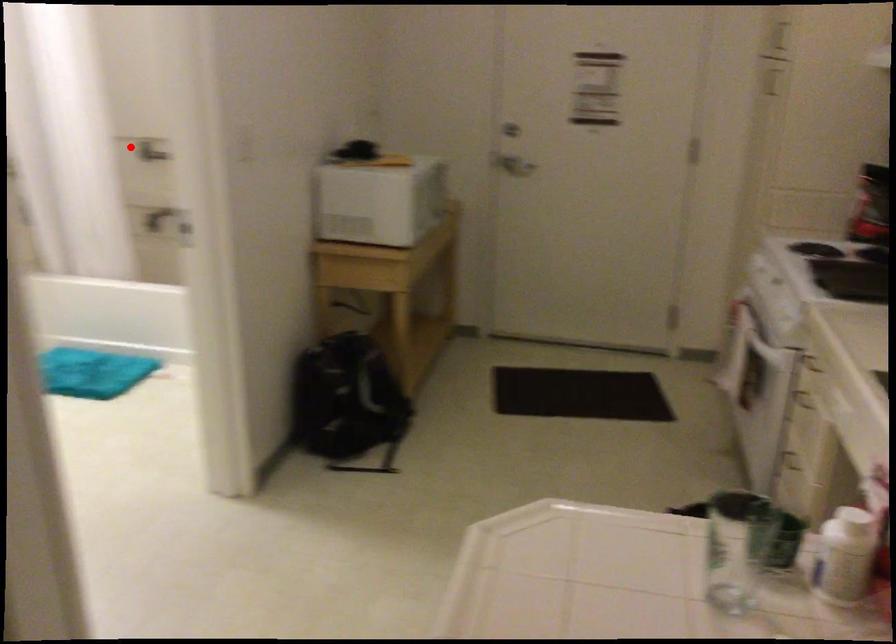
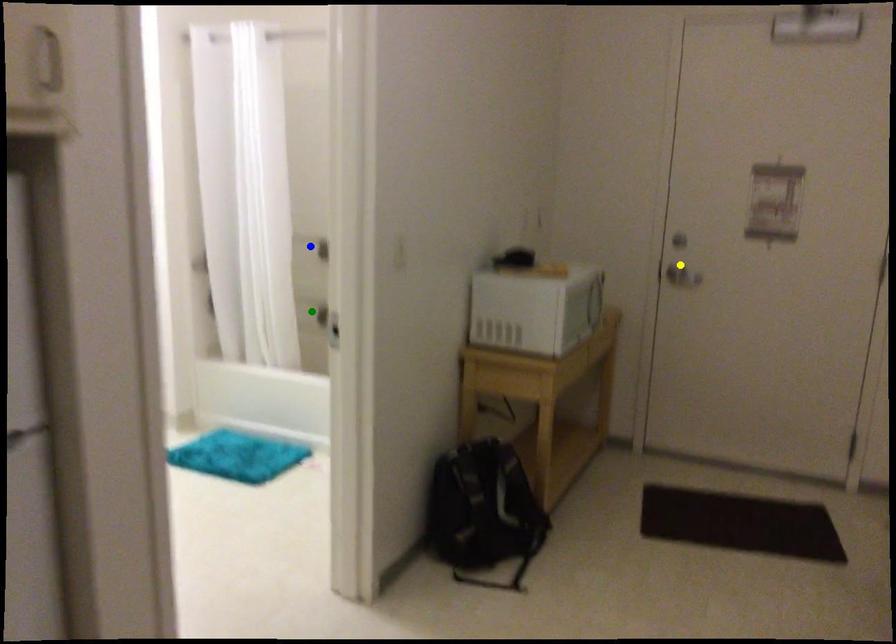
Question: I am providing you with two images of the same scene from different viewpoints. A red point is marked on the first image. You are given multiple points on the second image. In image 2, which mark is for the same physical point as the one in image 1?

Choices:
 (A) blue point
 (B) green point
 (C) yellow point

Answer: (A)